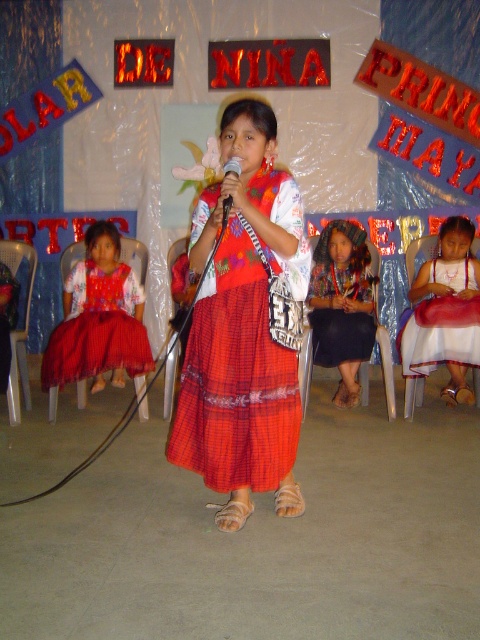
Question: Which object is positioned farthest from the red plaid skirt at center?

Choices:
 (A) white satin dress at lower right
 (B) black plastic microphone at center
 (C) red plaid skirt at lower left

Answer: (A)

Question: Among these points, which one is nearest to the camera?

Choices:
 (A) (224, 412)
 (B) (95, 355)

Answer: (A)

Question: Can you confirm if red plaid skirt at center is wider than red plaid skirt at lower left?

Choices:
 (A) no
 (B) yes

Answer: (A)

Question: Can you confirm if red plaid skirt at lower left is bigger than black plastic microphone at center?

Choices:
 (A) no
 (B) yes

Answer: (B)

Question: Where is red plaid skirt at lower left located in relation to black plastic microphone at center in the image?

Choices:
 (A) above
 (B) below

Answer: (B)

Question: Which of the following is the closest to the observer?

Choices:
 (A) (222, 481)
 (B) (112, 369)
 (C) (312, 282)
 (D) (410, 300)

Answer: (A)